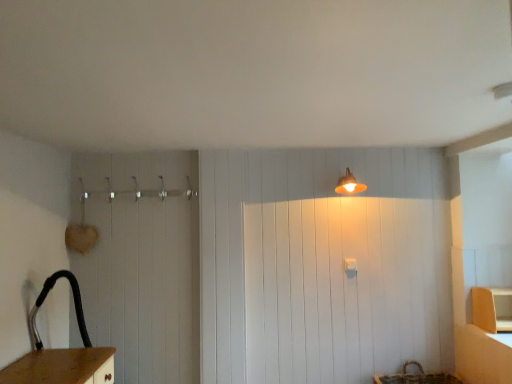
Question: Is matte orange lampshade at upper center wider than matte wood cabinet at lower right?

Choices:
 (A) yes
 (B) no

Answer: (B)

Question: From a real-world perspective, is matte orange lampshade at upper center beneath matte wood cabinet at lower right?

Choices:
 (A) yes
 (B) no

Answer: (B)

Question: Could you tell me if matte orange lampshade at upper center is facing matte wood cabinet at lower right?

Choices:
 (A) yes
 (B) no

Answer: (B)

Question: Is the surface of matte orange lampshade at upper center in direct contact with matte wood cabinet at lower right?

Choices:
 (A) yes
 (B) no

Answer: (B)

Question: From the image's perspective, does matte orange lampshade at upper center appear lower than matte wood cabinet at lower right?

Choices:
 (A) yes
 (B) no

Answer: (B)

Question: Can you confirm if matte orange lampshade at upper center is taller than matte wood cabinet at lower right?

Choices:
 (A) no
 (B) yes

Answer: (A)

Question: From the image's perspective, does matte wood cabinet at lower right appear lower than matte orange lampshade at upper center?

Choices:
 (A) yes
 (B) no

Answer: (A)

Question: Can you see matte wood cabinet at lower right touching matte orange lampshade at upper center?

Choices:
 (A) yes
 (B) no

Answer: (B)

Question: Does matte wood cabinet at lower right appear on the right side of matte orange lampshade at upper center?

Choices:
 (A) no
 (B) yes

Answer: (B)

Question: Can you confirm if matte wood cabinet at lower right is smaller than matte orange lampshade at upper center?

Choices:
 (A) yes
 (B) no

Answer: (B)

Question: Is matte orange lampshade at upper center inside matte wood cabinet at lower right?

Choices:
 (A) yes
 (B) no

Answer: (B)

Question: Is matte wood cabinet at lower right facing towards matte orange lampshade at upper center?

Choices:
 (A) yes
 (B) no

Answer: (B)

Question: Does point (499, 326) appear closer or farther from the camera than point (356, 185)?

Choices:
 (A) closer
 (B) farther

Answer: (A)